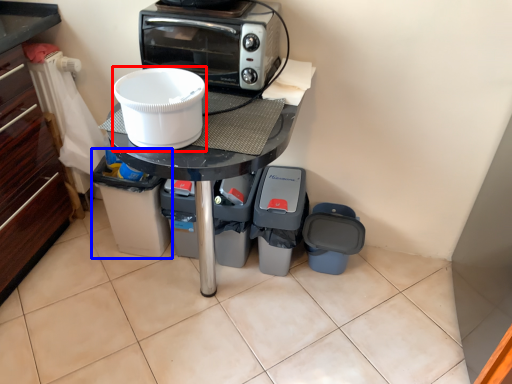
Question: Which object is further to the camera taking this photo, appliance (highlighted by a red box) or appliance (highlighted by a blue box)?

Choices:
 (A) appliance
 (B) appliance

Answer: (B)